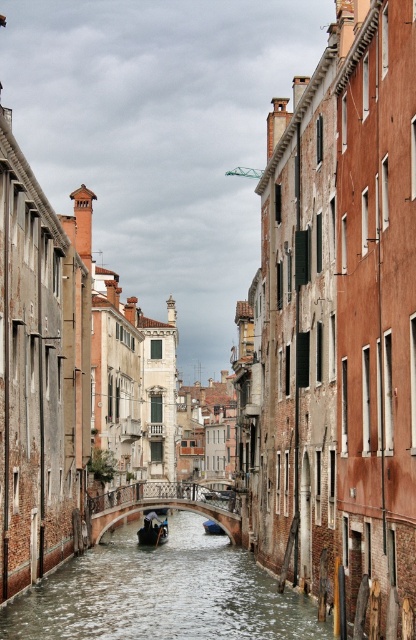
Is point (193, 628) more distant than point (208, 531)?

No, it is not.

Between clear water at canal center and blue glossy boat at center, which one is positioned lower?

blue glossy boat at center

Who is more forward, (232,595) or (222,531)?

Point (232,595) is more forward.

Locate an element on the screen. clear water at canal center is located at coordinates (161, 593).

Does clear water at canal center have a lesser width compared to wooden polished boat at center?

No.

Which of these two, clear water at canal center or wooden polished boat at center, stands taller?

With more height is clear water at canal center.

Who is more distant from viewer, (148,570) or (156,540)?

Positioned behind is point (156,540).

This screenshot has height=640, width=416. I want to click on clear water at canal center, so click(x=161, y=593).

Does wooden polished boat at center have a smaller size compared to blue glossy boat at center?

Correct, wooden polished boat at center occupies less space than blue glossy boat at center.

Between point (150, 541) and point (210, 524), which one is positioned behind?

The point (210, 524) is more distant.

The height and width of the screenshot is (640, 416). I want to click on wooden polished boat at center, so click(153, 531).